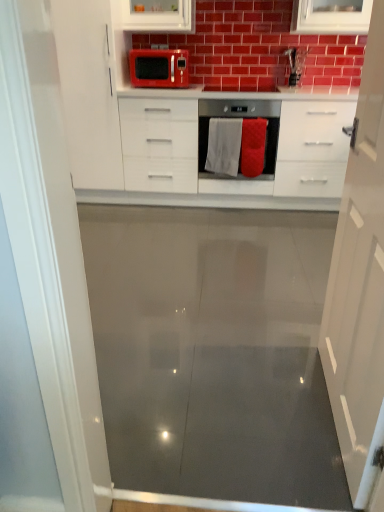
Question: Relative to white glossy cabinet at left, the first cabinetry from the top, is matte red microwave at upper center in front or behind?

Choices:
 (A) behind
 (B) front

Answer: (A)

Question: Based on their sizes in the image, would you say matte red microwave at upper center is bigger or smaller than white glossy cabinet at left, marked as the second cabinetry in a front-to-back arrangement?

Choices:
 (A) big
 (B) small

Answer: (B)

Question: Estimate the real-world distances between objects in this image. Which object is farther from the satin silver oven at center?

Choices:
 (A) white glossy cabinet at left, which ranks as the second cabinetry in bottom-to-top order
 (B) red fabric towel at center, marked as the 2th material in a left-to-right arrangement
 (C) white glossy cabinet at center
 (D) white glossy cabinet at center, the 1th cabinetry positioned from the front
 (E) white fabric towel at center, which is the 1th material from left to right

Answer: (D)

Question: Based on their relative distances, which object is farther from the satin silver oven at center?

Choices:
 (A) matte red microwave at upper center
 (B) white glossy cabinet at center
 (C) white fabric towel at center, which is the 1th material from left to right
 (D) white glossy cabinet at left, the first cabinetry from the top
 (E) red fabric towel at center, marked as the 2th material in a left-to-right arrangement

Answer: (D)